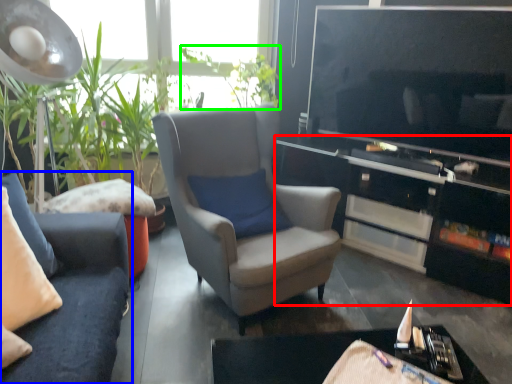
Question: Considering the real-world distances, which object is closest to cabinetry (highlighted by a red box)? studio couch (highlighted by a blue box) or plant (highlighted by a green box).

Choices:
 (A) studio couch
 (B) plant

Answer: (B)